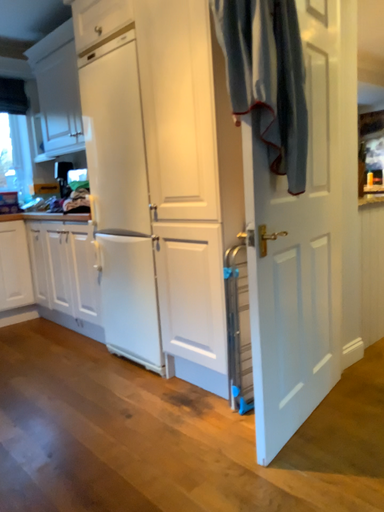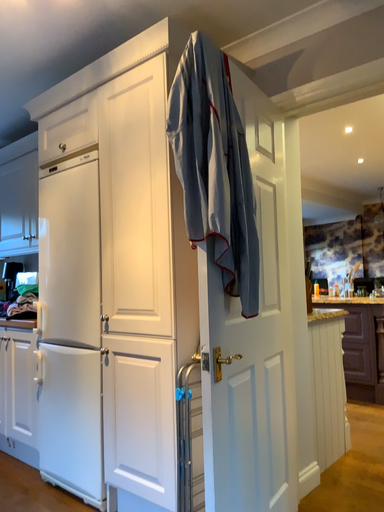
Question: Which way did the camera rotate in the video?

Choices:
 (A) rotated left
 (B) rotated right

Answer: (B)